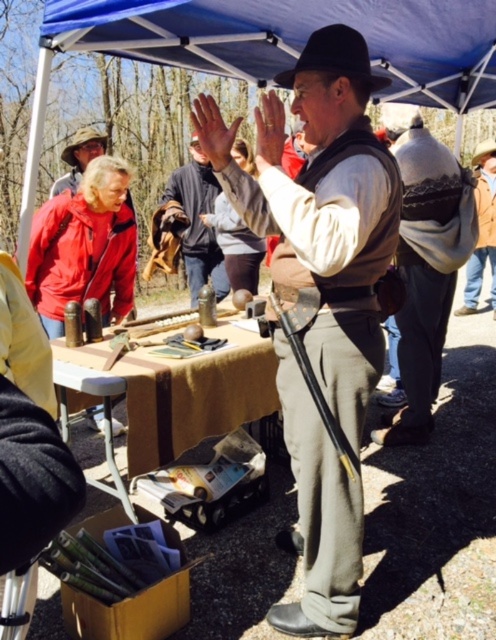
You are a visitor at the event and want to take a photo of the yellow fabric table at center and the matte brown vest at center. Which object should you focus on first to ensure both are in the frame?

The matte brown vest at center is positioned on the right side of the yellow fabric table at center, so you should focus on the yellow fabric table at center first to ensure both are in the frame.

You are an event organizer setting up a photo shoot under the blue canopy tent. You need to ensure that the blue fabric canopy at upper center does not block the smooth skin hand at center in the photos. Based on their height difference, will the canopy interfere with capturing clear shots of the hand?

The blue fabric canopy at upper center is much taller than the smooth skin hand at center, so it will not block the hand in the photos.

You are standing in the center of the tent and want to locate the matte brown vest at center. According to the coordinates provided, in which direction should you move to find it?

The matte brown vest at center is located at coordinates point (330, 221). Since you are at the center of the tent, you should move slightly to the left and forward to reach it.